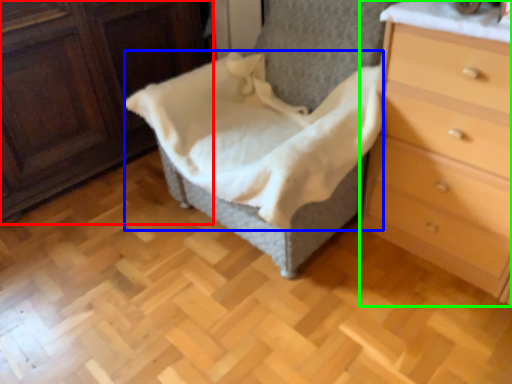
Question: Which object is the closest to the furniture (highlighted by a red box)? Choose among these: blanket (highlighted by a blue box) or chest of drawers (highlighted by a green box).

Choices:
 (A) blanket
 (B) chest of drawers

Answer: (A)